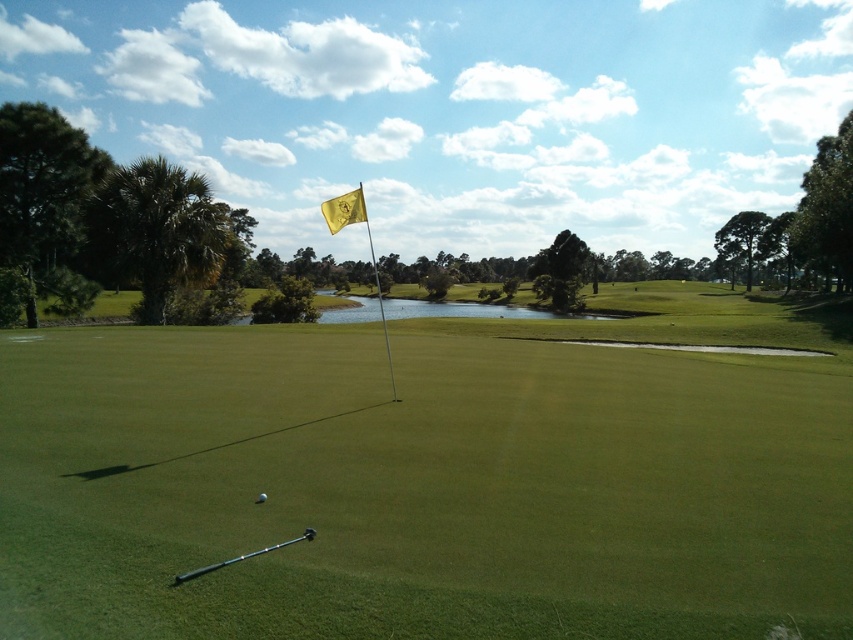
Question: Does green smooth grass at center appear on the left side of white matte golf ball at center?

Choices:
 (A) no
 (B) yes

Answer: (A)

Question: Which of the following is the closest to the observer?

Choices:
 (A) black rubber golf club at lower center
 (B) white matte golf ball at center
 (C) green smooth grass at center

Answer: (C)

Question: Which is nearer to the green smooth grass at center?

Choices:
 (A) gold fabric flag at center
 (B) white matte golf ball at center
 (C) black rubber golf club at lower center

Answer: (A)

Question: Is the position of black rubber golf club at lower center less distant than that of white matte golf ball at center?

Choices:
 (A) yes
 (B) no

Answer: (A)

Question: Considering the real-world distances, which object is closest to the gold fabric flag at center?

Choices:
 (A) black rubber golf club at lower center
 (B) green smooth grass at center
 (C) white matte golf ball at center

Answer: (A)

Question: Does green smooth grass at center appear under gold fabric flag at center?

Choices:
 (A) no
 (B) yes

Answer: (B)